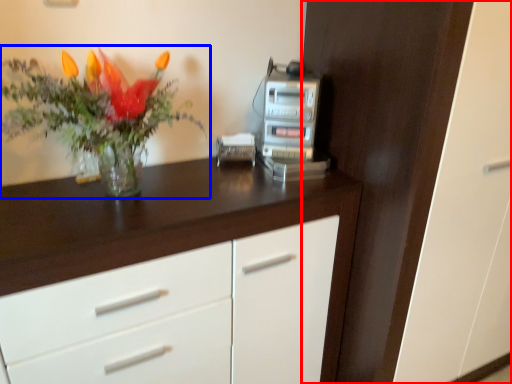
Question: Among these objects, which one is nearest to the camera, dresser (highlighted by a red box) or houseplant (highlighted by a blue box)?

Choices:
 (A) dresser
 (B) houseplant

Answer: (B)